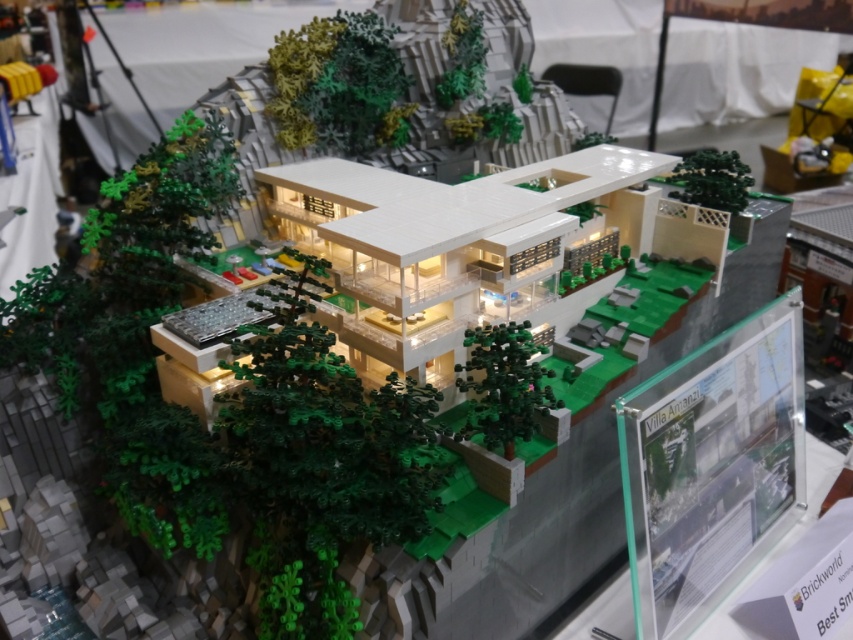
Question: Does green matte tree at upper center appear on the right side of green matte tree at upper right?

Choices:
 (A) yes
 (B) no

Answer: (B)

Question: Does green matte tree at upper center have a lesser width compared to green matte tree at center?

Choices:
 (A) no
 (B) yes

Answer: (A)

Question: Is green matte tree at upper center bigger than green matte tree at upper right?

Choices:
 (A) no
 (B) yes

Answer: (B)

Question: Estimate the real-world distances between objects in this image. Which object is farther from the green matte tree at upper right?

Choices:
 (A) green matte tree at center
 (B) green matte tree at upper center

Answer: (A)

Question: Which of these objects is positioned farthest from the green matte tree at center?

Choices:
 (A) green matte tree at upper center
 (B) green matte tree at upper right

Answer: (A)

Question: Which point is closer to the camera taking this photo?

Choices:
 (A) (317, 90)
 (B) (521, 348)
 (C) (683, 177)

Answer: (B)